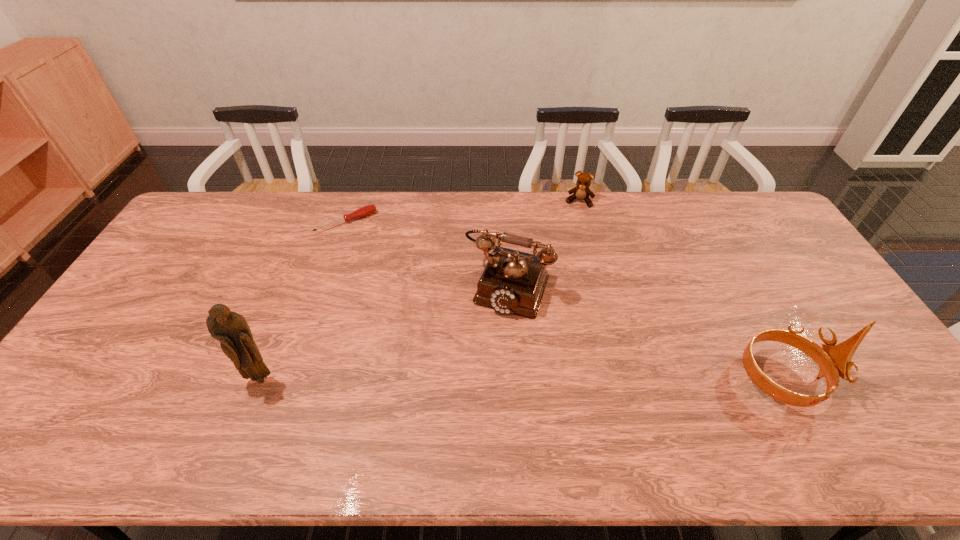
What are the coordinates of `vacant space located at the tip of the shortest object` in the screenshot? It's located at (374, 252).

The image size is (960, 540). Identify the location of vacant space located at the tip of the shortest object. (415, 306).

At what (x,y) coordinates should I click in order to perform the action: click on vacant space located 0.180m at the tip of the shortest object. Please return your answer as a coordinate pair (x, y). Image resolution: width=960 pixels, height=540 pixels. Looking at the image, I should click on (382, 262).

Locate an element on the screen. vacant space located 0.070m on the dial of the telephone is located at coordinates (488, 336).

At what (x,y) coordinates should I click in order to perform the action: click on vacant space located 0.300m on the dial of the telephone. Please return your answer as a coordinate pair (x, y). The image size is (960, 540). Looking at the image, I should click on pyautogui.click(x=457, y=409).

Image resolution: width=960 pixels, height=540 pixels. I want to click on blank space located on the dial of the telephone, so click(x=463, y=395).

You are a GUI agent. You are given a task and a screenshot of the screen. Output one action in this format:
    pyautogui.click(x=<x>, y=<y>)
    Task: Click on the vacant region located on the front-facing side of the teddy bear
    This screenshot has height=540, width=960.
    Given the screenshot: What is the action you would take?
    pyautogui.click(x=559, y=264)

Find the location of a particular element. The width and height of the screenshot is (960, 540). vacant space located 0.250m on the front-facing side of the teddy bear is located at coordinates (563, 252).

Image resolution: width=960 pixels, height=540 pixels. What are the coordinates of `vacant space located 0.160m on the front-facing side of the teddy bear` in the screenshot? It's located at (568, 235).

You are a GUI agent. You are given a task and a screenshot of the screen. Output one action in this format:
    pyautogui.click(x=<x>, y=<y>)
    Task: Click on the screwdriver at the far edge
    Image resolution: width=960 pixels, height=540 pixels.
    Given the screenshot: What is the action you would take?
    pyautogui.click(x=366, y=210)